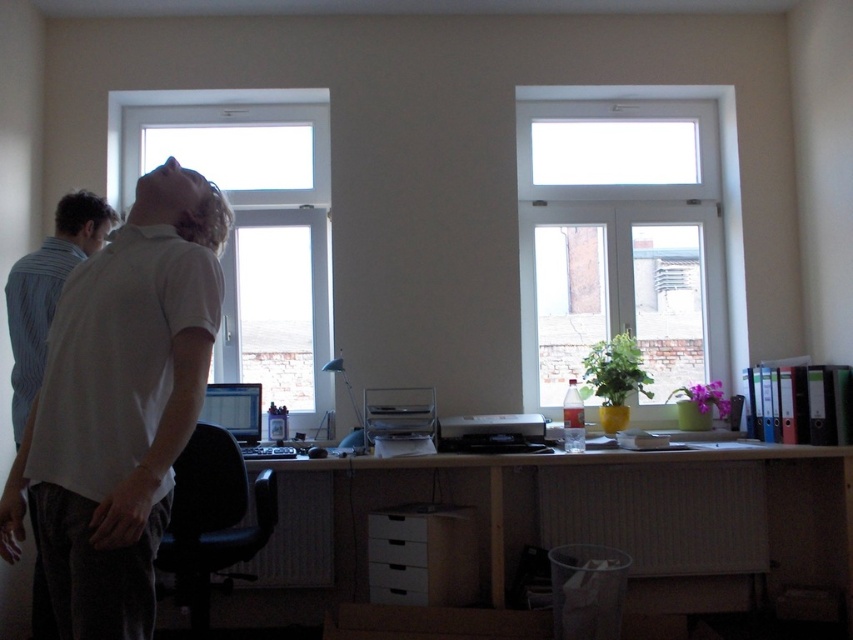
Question: Which object is the closest to the matte black monitor at center?

Choices:
 (A) white cotton shirt at center
 (B) transparent glass window at upper left
 (C) white glossy computer desk at center

Answer: (B)

Question: Which of the following is the farthest from the observer?

Choices:
 (A) white cotton shirt at center
 (B) transparent glass window at upper left
 (C) transparent glass window at upper center
 (D) matte black monitor at center

Answer: (C)

Question: Can you confirm if transparent glass window at upper center is bigger than white cotton shirt at center?

Choices:
 (A) no
 (B) yes

Answer: (B)

Question: Observing the image, what is the correct spatial positioning of transparent glass window at upper center in reference to transparent glass window at upper left?

Choices:
 (A) left
 (B) right

Answer: (B)

Question: Is transparent glass window at upper center thinner than white glossy computer desk at center?

Choices:
 (A) yes
 (B) no

Answer: (A)

Question: Which of the following is the closest to the observer?

Choices:
 (A) (846, 531)
 (B) (735, 188)
 (C) (204, 406)
 (D) (47, 499)

Answer: (D)